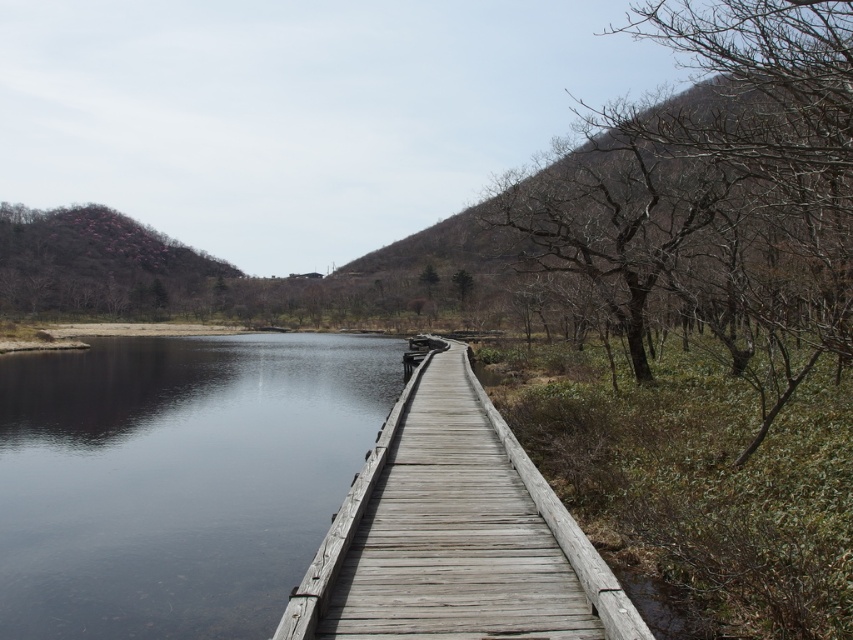
You are standing on the weathered wood dock at center and looking towards the transparent water at center. Which object is higher in elevation?

The transparent water at center is much taller than the weathered wood dock at center, so the transparent water at center is higher in elevation.

You are a hiker who wants to cross the transparent water at center and the weathered wood dock at center. Which path is wider?

The transparent water at center is wider than the weathered wood dock at center, so the transparent water at center is the wider path.